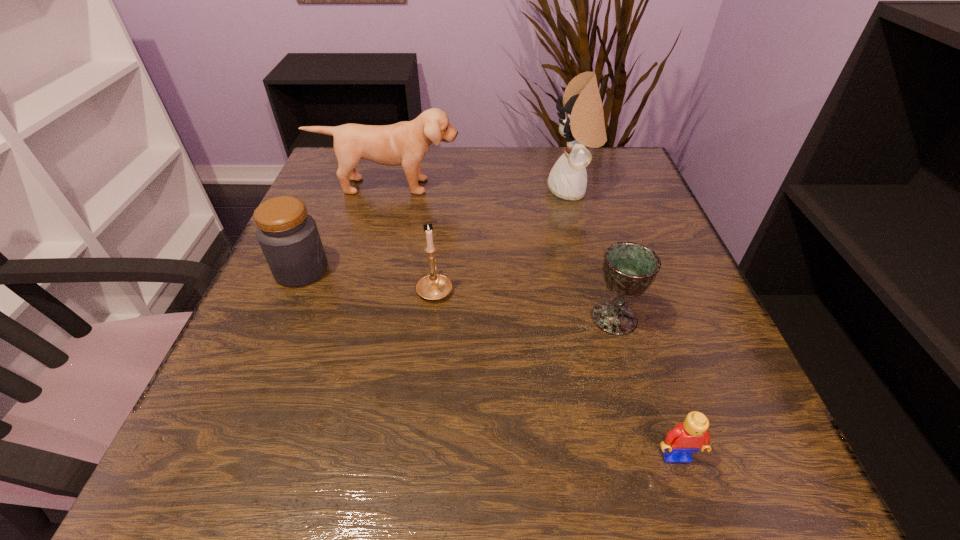
I want to click on jar positioned at the left edge, so click(288, 236).

Where is `doll that is at the right edge`? doll that is at the right edge is located at coordinates (583, 124).

Find the location of `chalice that is at the right edge`. chalice that is at the right edge is located at coordinates (629, 268).

The image size is (960, 540). Find the location of `Lego present at the right edge`. Lego present at the right edge is located at coordinates (687, 437).

This screenshot has width=960, height=540. Find the location of `object situated at the far left corner`. object situated at the far left corner is located at coordinates (405, 143).

What are the coordinates of `object present at the far right corner` in the screenshot? It's located at (583, 124).

Identify the location of object present at the near right corner. (687, 437).

In the image, there is a desktop. At what (x,y) coordinates should I click in order to perform the action: click on blank space at the far edge. Please return your answer as a coordinate pair (x, y). The height and width of the screenshot is (540, 960). Looking at the image, I should click on (499, 184).

You are a GUI agent. You are given a task and a screenshot of the screen. Output one action in this format:
    pyautogui.click(x=<x>, y=<y>)
    Task: Click on the free spot at the near edge of the desktop
    The height and width of the screenshot is (540, 960).
    Given the screenshot: What is the action you would take?
    pyautogui.click(x=611, y=443)

At what (x,y) coordinates should I click in order to perform the action: click on free space at the left edge of the desktop. Please return your answer as a coordinate pair (x, y). This screenshot has width=960, height=540. Looking at the image, I should click on pyautogui.click(x=355, y=263).